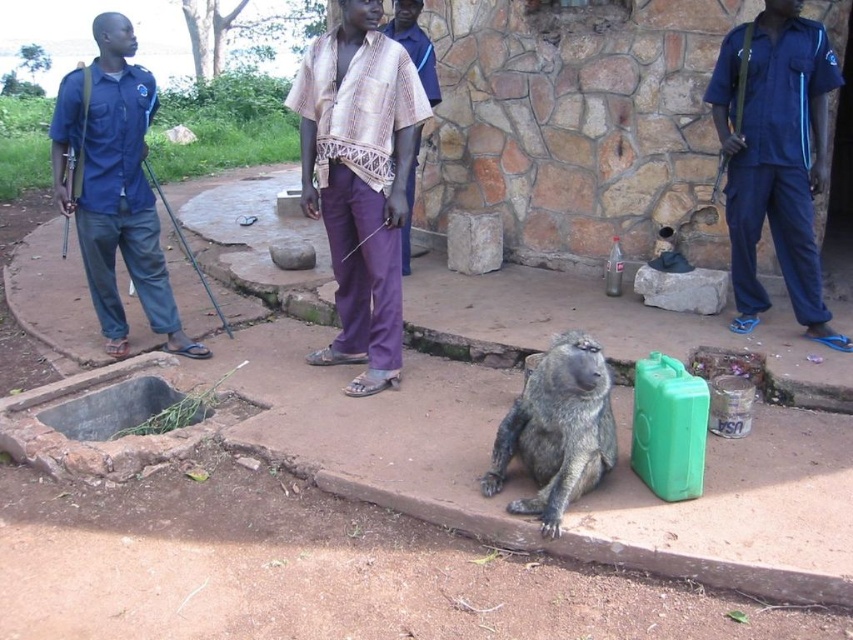
Is point (113, 224) positioned in front of point (407, 269)?

That is True.

Looking at this image, which is more to the left, blue uniform at left or patterned fabric shirt at center?

Positioned to the left is blue uniform at left.

Does point (105, 221) come behind point (408, 205)?

No, it is in front of (408, 205).

Locate an element on the screen. blue uniform at left is located at coordinates (115, 186).

You are a GUI agent. You are given a task and a screenshot of the screen. Output one action in this format:
    pyautogui.click(x=<x>, y=<y>)
    Task: Click on the gray furry monkey at center
    This screenshot has height=640, width=853.
    Given the screenshot: What is the action you would take?
    pyautogui.click(x=556, y=429)

Can you confirm if gray furry monkey at center is taller than patterned fabric shirt at center?

Incorrect, gray furry monkey at center's height is not larger of patterned fabric shirt at center's.

Is point (538, 362) positioned after point (430, 76)?

No, it is not.

Where is `gray furry monkey at center`? This screenshot has width=853, height=640. gray furry monkey at center is located at coordinates (556, 429).

You are a GUI agent. You are given a task and a screenshot of the screen. Output one action in this format:
    pyautogui.click(x=<x>, y=<y>)
    Task: Click on the purple cotton pants at center
    The width and height of the screenshot is (853, 640).
    Given the screenshot: What is the action you would take?
    pyautogui.click(x=358, y=180)

Who is positioned more to the right, purple cotton pants at center or blue uniform at left?

purple cotton pants at center

This screenshot has width=853, height=640. I want to click on purple cotton pants at center, so click(x=358, y=180).